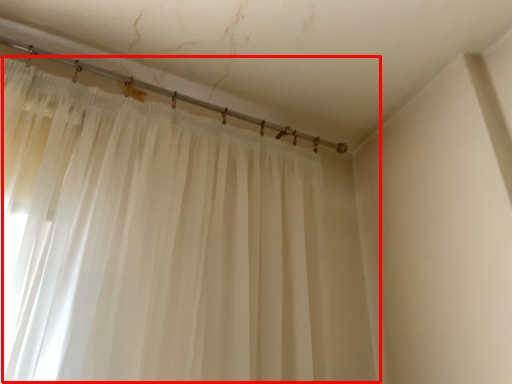
Question: From the image, what is the correct spatial relationship of curtain (annotated by the red box) in relation to beam?

Choices:
 (A) right
 (B) left

Answer: (A)